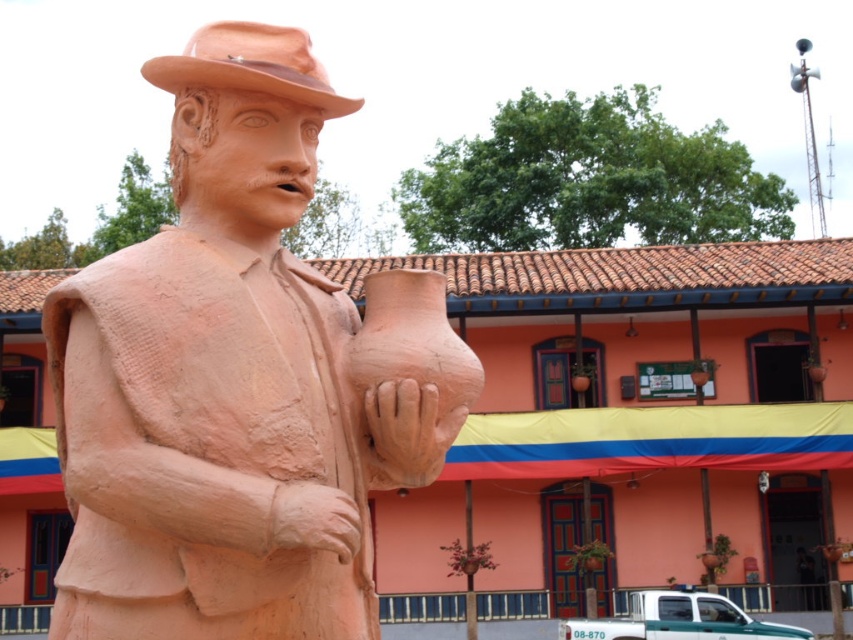
You are an art student observing the matte clay statue at center and the matte clay fedora at upper center in the scene. Which object is larger in size?

The matte clay fedora at upper center is larger than the matte clay statue at center.

You are an art student standing in front of the matte clay statue at center and the matte clay fedora at upper center. Which object is positioned closer to you?

The matte clay statue at center is closer to the viewer than the matte clay fedora at upper center.